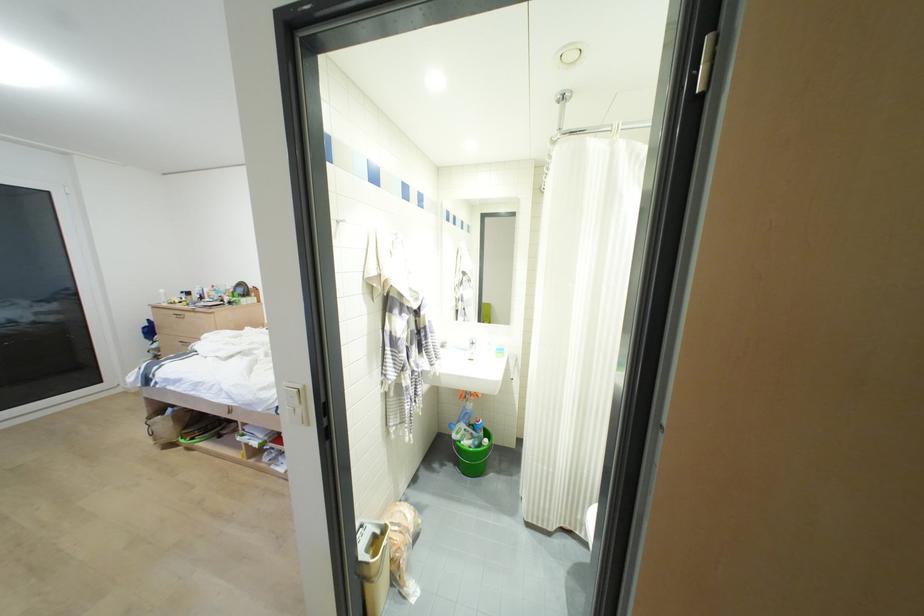
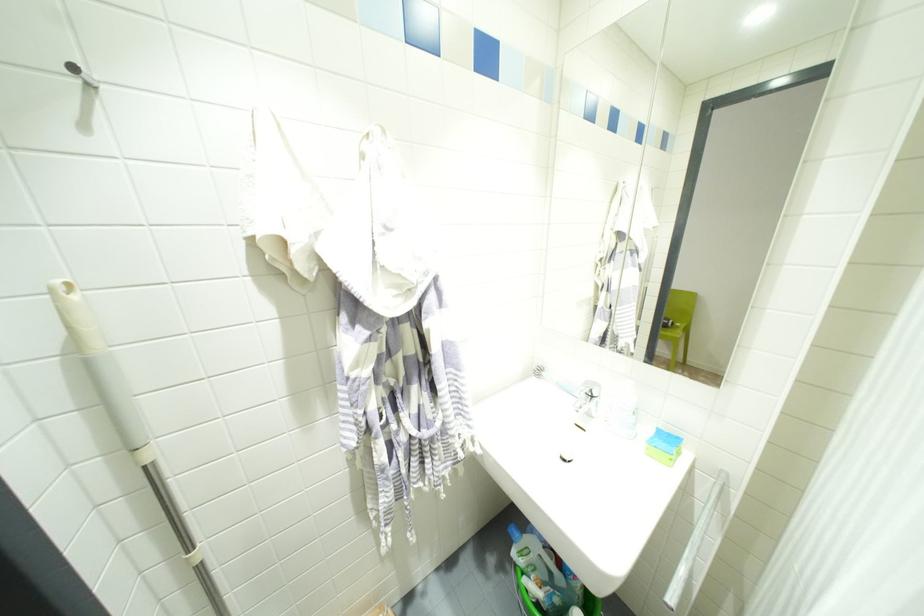
Locate, in the second image, the point that corresponds to (500,350) in the first image.

(667, 439)